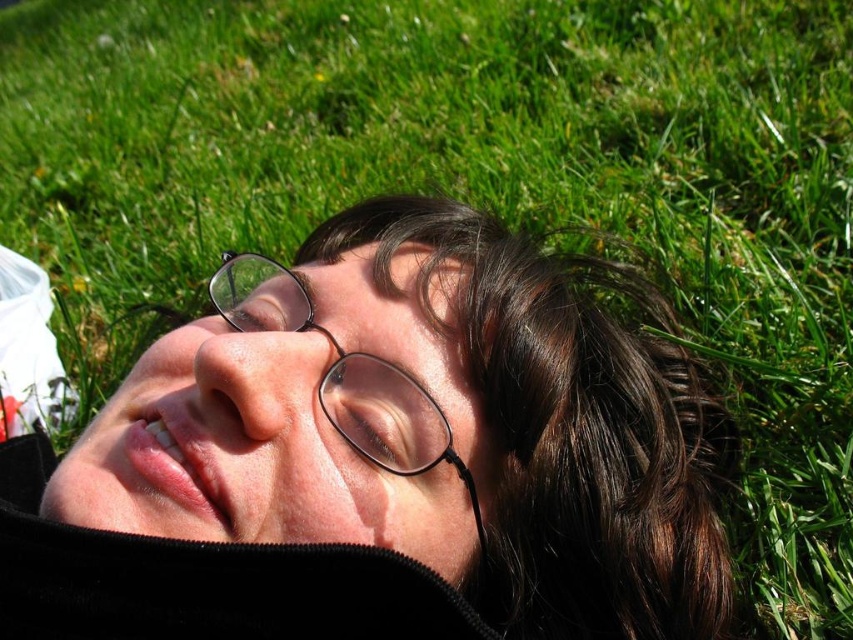
Question: Which point appears farthest from the camera in this image?

Choices:
 (A) (566, 316)
 (B) (407, 444)

Answer: (A)

Question: Is matte black glasses at center in front of clear plastic glasses at center?

Choices:
 (A) no
 (B) yes

Answer: (B)

Question: Can you confirm if matte black glasses at center is positioned to the left of clear plastic glasses at center?

Choices:
 (A) no
 (B) yes

Answer: (A)

Question: Does matte black glasses at center have a lesser width compared to clear plastic glasses at center?

Choices:
 (A) yes
 (B) no

Answer: (B)

Question: Which object appears closest to the camera in this image?

Choices:
 (A) clear plastic glasses at center
 (B) matte black glasses at center

Answer: (B)